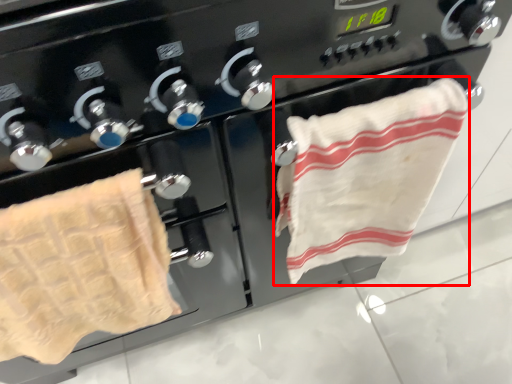
Question: From the image's perspective, considering the relative positions of towel (annotated by the red box) and towel in the image provided, where is towel (annotated by the red box) located with respect to the staircase?

Choices:
 (A) above
 (B) below

Answer: (A)